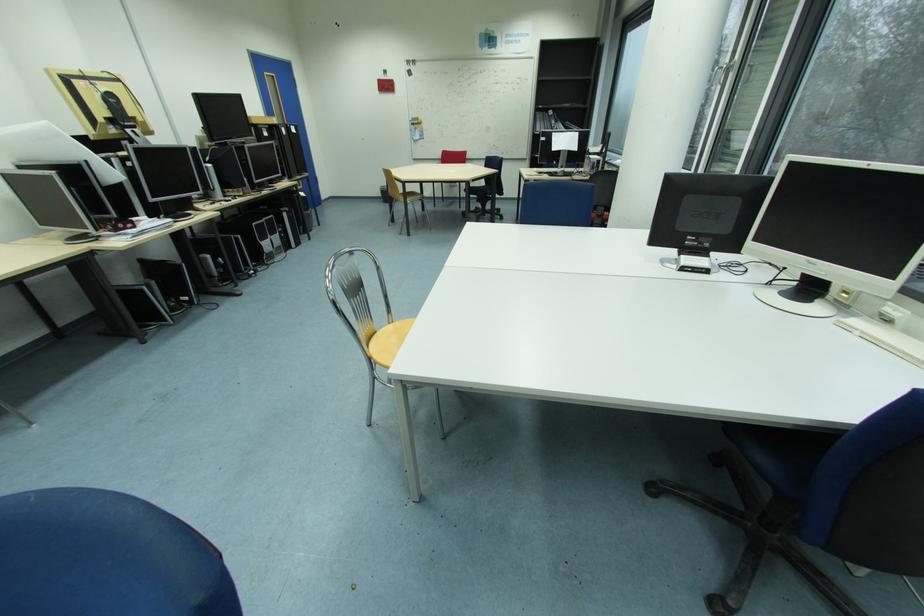
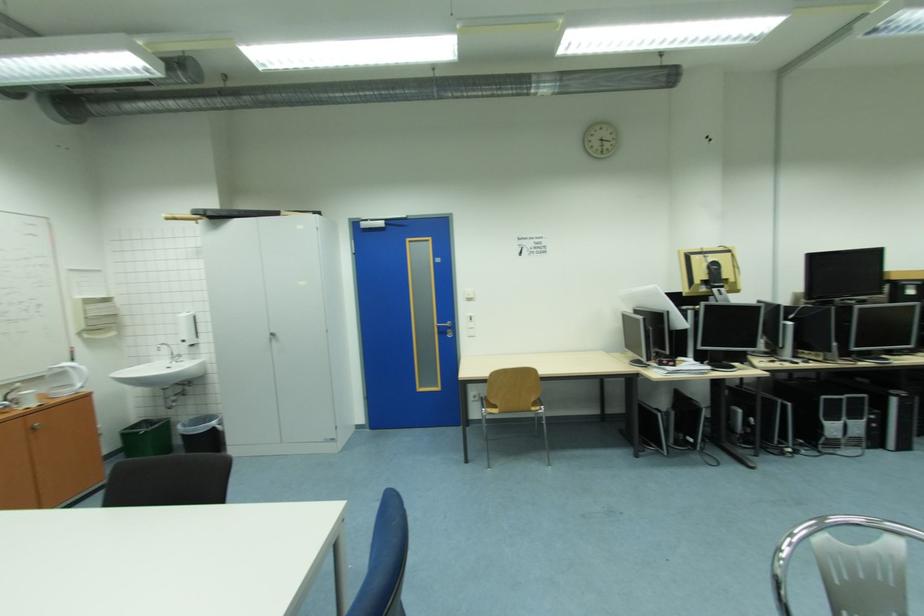
Question: The camera is either moving clockwise (left) or counter-clockwise (right) around the object. The first image is from the beginning of the video and the second image is from the end. Is the camera moving left or right when shooting the video?

Choices:
 (A) Left
 (B) Right

Answer: (B)